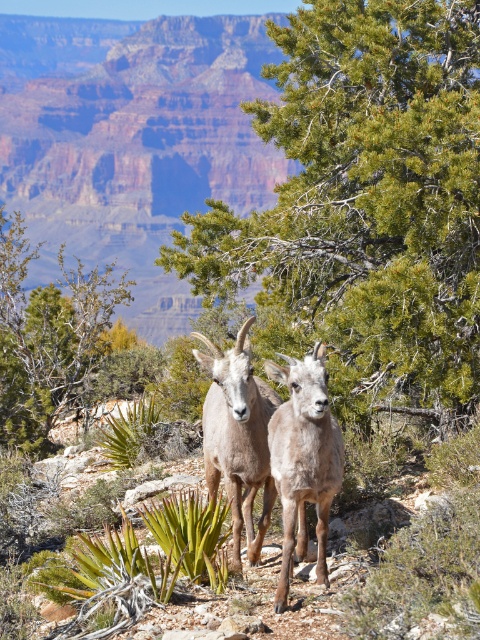
You are a wildlife photographer aiming to capture the fuzzy brown goat at center in your shot. Given the coordinates provided, can you determine if the goat is positioned centrally within the frame?

The fuzzy brown goat at center is located at point coordinates of (303, 458). Since the center of the frame would typically be at coordinates around (240, 320), the goat is slightly shifted to the right and downward from the exact center.

You are a hiker trying to navigate to the green leafy tree at center from your current position. Based on the scene description, which direction should you head relative to your current position?

The green leafy tree at center is located at point (48, 337), so you should head towards the center of the scene to reach it.